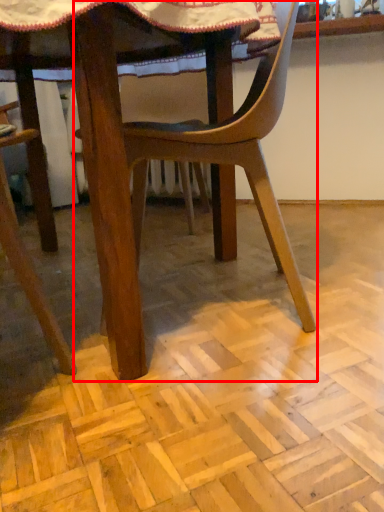
Question: In this image, where is chair (annotated by the red box) located relative to plywood?

Choices:
 (A) right
 (B) left

Answer: (B)